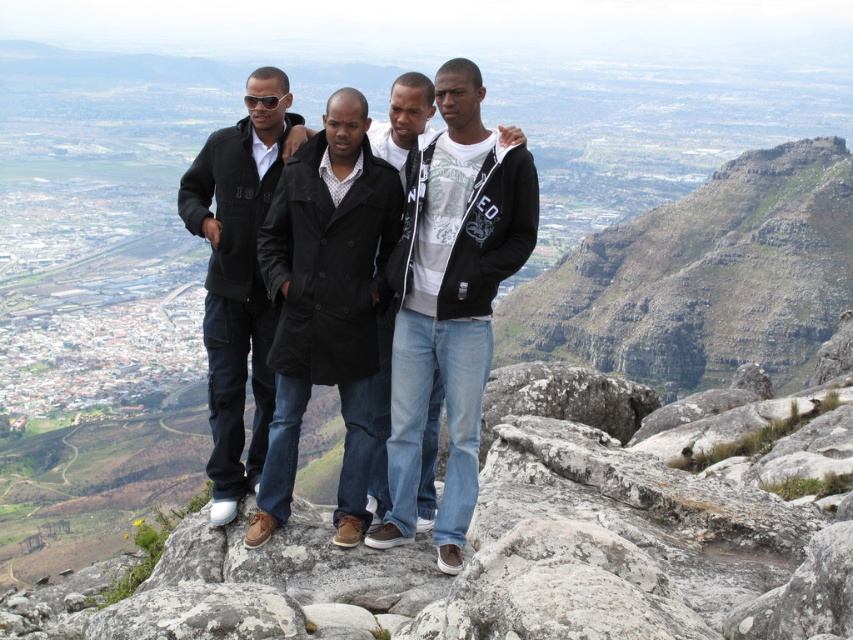
Is rugged stone mountain at upper right to the left of black matte coat at center from the viewer's perspective?

Incorrect, rugged stone mountain at upper right is not on the left side of black matte coat at center.

Between rugged stone mountain at upper right and black matte coat at center, which one is positioned lower?

black matte coat at center is lower down.

At what (x,y) coordinates should I click in order to perform the action: click on rugged stone mountain at upper right. Please return your answer as a coordinate pair (x, y). This screenshot has width=853, height=640. Looking at the image, I should click on (701, 276).

The width and height of the screenshot is (853, 640). In order to click on rugged stone mountain at upper right in this screenshot , I will do `click(701, 276)`.

Based on the photo, does rugged stone mountain at upper right have a lesser height compared to matte black coat at center?

No.

Is rugged stone mountain at upper right positioned at the back of matte black coat at center?

Yes, it is.

What do you see at coordinates (701, 276) in the screenshot? I see `rugged stone mountain at upper right` at bounding box center [701, 276].

Locate an element on the screen. The height and width of the screenshot is (640, 853). rugged stone mountain at upper right is located at coordinates (701, 276).

This screenshot has height=640, width=853. Describe the element at coordinates (326, 305) in the screenshot. I see `black matte coat at center` at that location.

Is black matte coat at center behind black fleece jacket at center?

No, black matte coat at center is in front of black fleece jacket at center.

Between point (340, 173) and point (260, 188), which one is positioned in front?

Point (340, 173)

Locate an element on the screen. black matte coat at center is located at coordinates (326, 305).